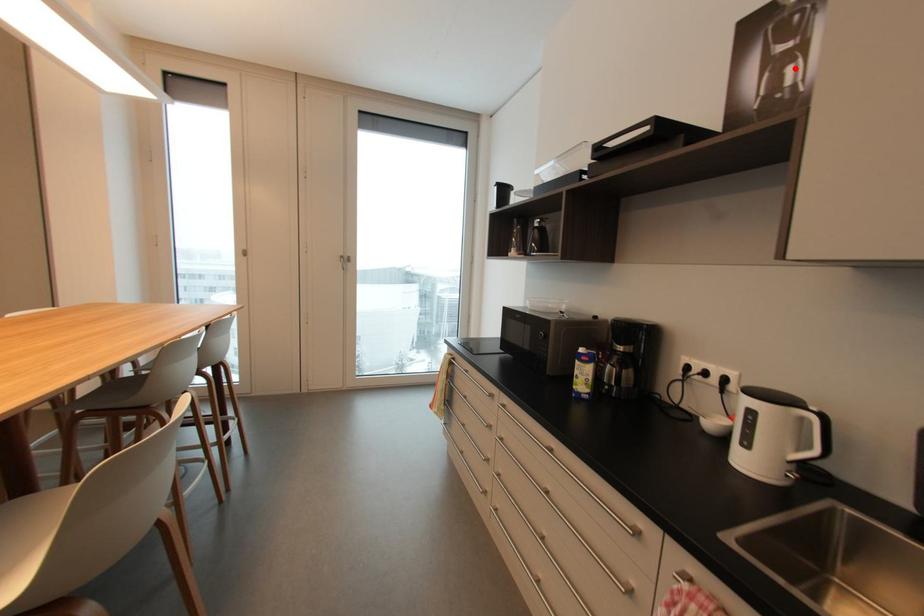
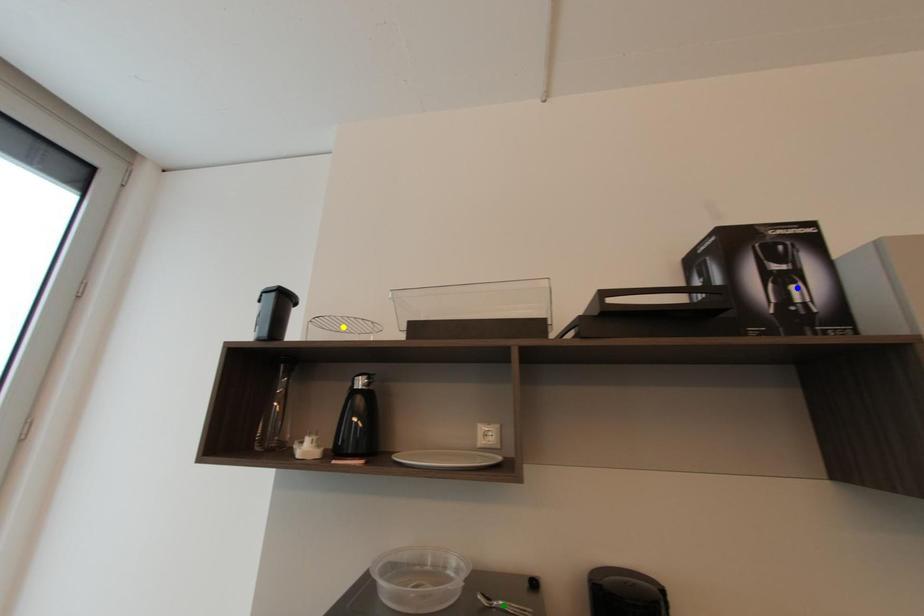
Question: I am providing you with two images of the same scene from different viewpoints. A red point is marked on the first image. You are given multiple points on the second image. Which mark in image 2 goes with the point in image 1?

Choices:
 (A) yellow point
 (B) green point
 (C) blue point

Answer: (C)